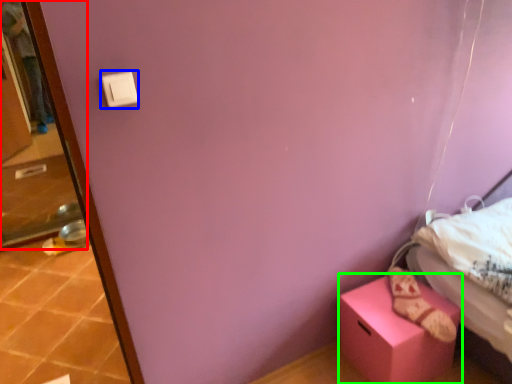
Question: Which is farther away from screen door (highlighted by a red box)? light switch (highlighted by a blue box) or box (highlighted by a green box)?

Choices:
 (A) light switch
 (B) box

Answer: (A)